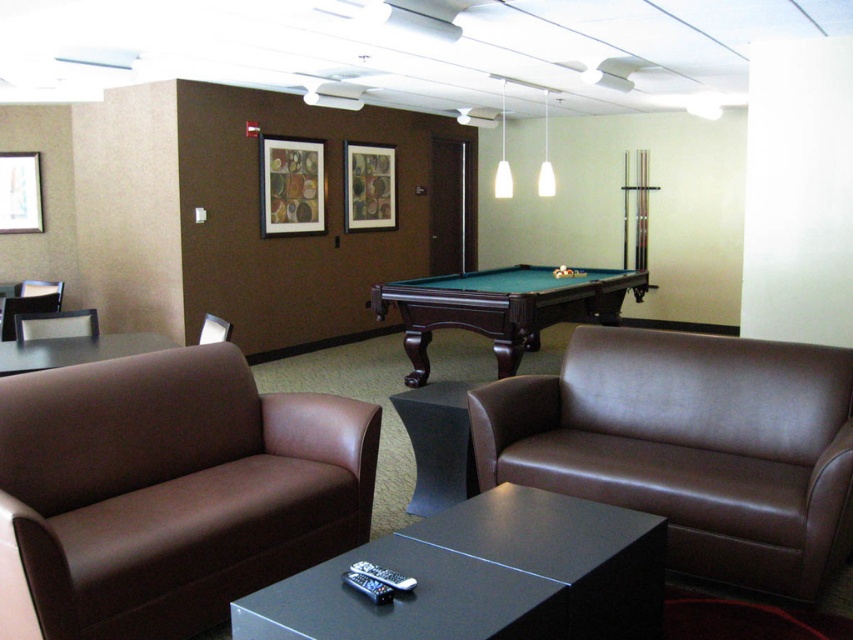
You are standing at the entrance of the recreational room and want to move from the black glossy coffee table at center to the green felt pool table at center. Which direction should you move towards?

The black glossy coffee table at center is to the left of green felt pool table at center, so you should move towards the right to reach the green felt pool table at center.

You are a delivery person who needs to place a 3.5 meter long sofa in the modern recreational room. The sofa must be placed between the black glass table at lower left and the matte black picture frame at upper center. Is there enough space to fit the sofa horizontally between them?

The distance between the black glass table at lower left and the matte black picture frame at upper center is 3.58 meters. Since the sofa is 3.5 meters long, there is enough space to fit it horizontally between them with a small amount of extra space remaining.

You are arranging a party in the recreational room and need to move the brown leather chair at left closer to the pool table. However, there is a matte wood picture frame at upper center in the way. To avoid hitting the frame, which direction should you move the chair?

The matte wood picture frame at upper center is to the right of the brown leather chair at left. To avoid hitting the frame, you should move the brown leather chair at left to the left direction.